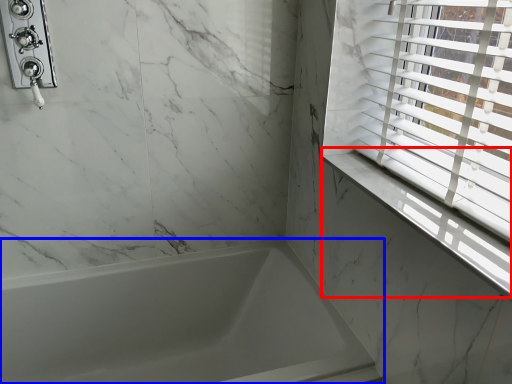
Question: Among these objects, which one is farthest to the camera, window sill (highlighted by a red box) or bathtub (highlighted by a blue box)?

Choices:
 (A) window sill
 (B) bathtub

Answer: (B)